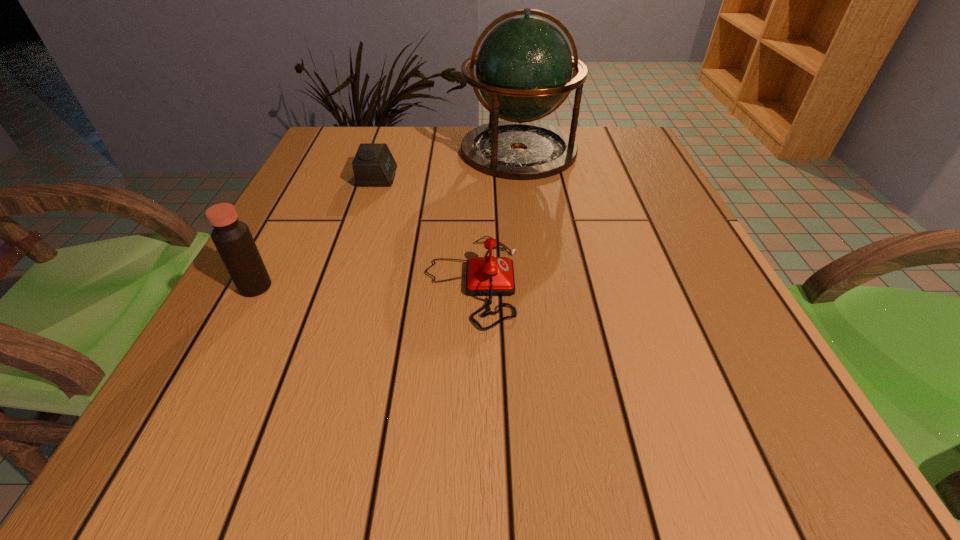
Where is `vacant space that satisfies the following two spatial constraints: 1. on the front-facing side of the third object from right to left; 2. on the front side of the vinegar`? The width and height of the screenshot is (960, 540). vacant space that satisfies the following two spatial constraints: 1. on the front-facing side of the third object from right to left; 2. on the front side of the vinegar is located at coordinates (343, 287).

This screenshot has height=540, width=960. I want to click on free location that satisfies the following two spatial constraints: 1. on the front-facing side of the tallest object; 2. on the front-facing side of the second object from left to right, so click(522, 177).

Identify the location of free location that satisfies the following two spatial constraints: 1. on the front-facing side of the third object from right to left; 2. on the front side of the vinegar. (343, 287).

Locate an element on the screen. The width and height of the screenshot is (960, 540). vacant space that satisfies the following two spatial constraints: 1. on the dial of the telephone; 2. on the front side of the vinegar is located at coordinates coord(472,287).